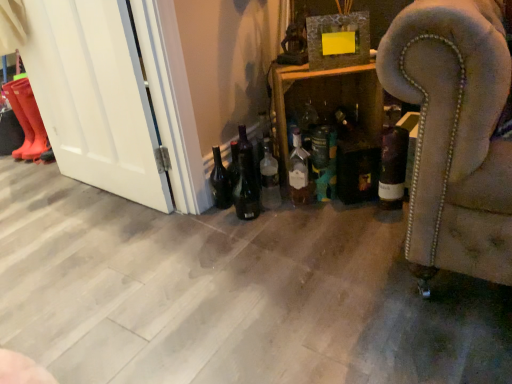
The width and height of the screenshot is (512, 384). In order to click on free location in front of matte glass bottle at center, which appears as the 2th bottle when viewed from the left in this screenshot , I will do click(x=310, y=220).